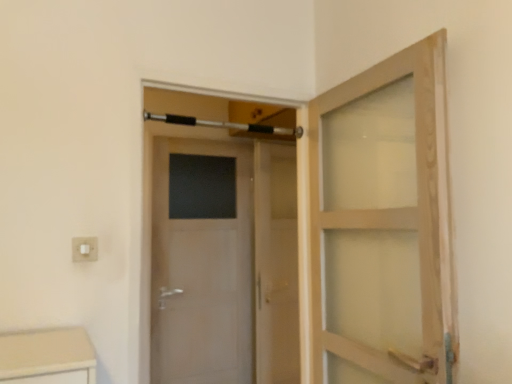
Question: Is clear glass screen door at center to the left or to the right of white glossy door at center in the image?

Choices:
 (A) left
 (B) right

Answer: (B)

Question: From their relative heights in the image, would you say clear glass screen door at center is taller or shorter than white glossy door at center?

Choices:
 (A) tall
 (B) short

Answer: (A)

Question: Which of these objects is positioned farthest from the white glossy door at center?

Choices:
 (A) clear glass screen door at center
 (B) silver metallic towel bar at upper center
 (C) white plastic electric outlet at lower left

Answer: (C)

Question: Which object is positioned farthest from the silver metallic towel bar at upper center?

Choices:
 (A) clear glass screen door at center
 (B) white plastic electric outlet at lower left
 (C) white glossy door at center

Answer: (B)